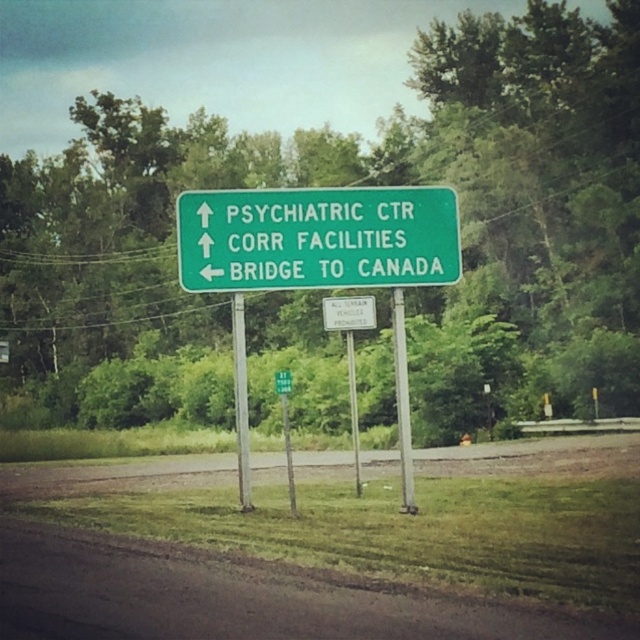
Question: Does green matte sign at center appear over silver metallic pole at center?

Choices:
 (A) no
 (B) yes

Answer: (B)

Question: Which of the following is the closest to the observer?

Choices:
 (A) green metal pole at center
 (B) silver metallic pole at center
 (C) green matte sign at center
 (D) green metallic pole at center

Answer: (D)

Question: Can you confirm if silver metallic pole at center is smaller than green metal pole at center?

Choices:
 (A) yes
 (B) no

Answer: (B)

Question: Based on their relative distances, which object is nearer to the silver metallic pole at center?

Choices:
 (A) green matte sign at center
 (B) white plastic sign at center
 (C) green metal pole at center
 (D) green metallic pole at center

Answer: (D)

Question: Which point is closer to the camera?

Choices:
 (A) silver metallic pole at center
 (B) green metal pole at center
 (C) green matte sign at center

Answer: (A)

Question: Is green matte sign at center closer to camera compared to green metallic pole at center?

Choices:
 (A) yes
 (B) no

Answer: (B)